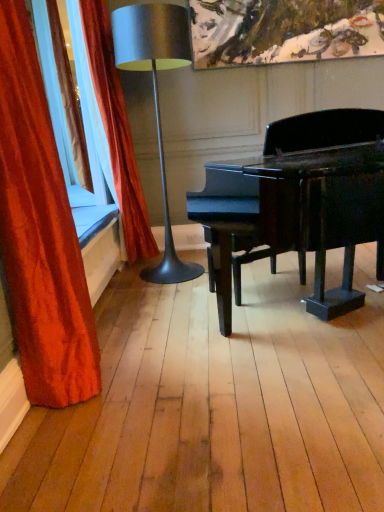
Image resolution: width=384 pixels, height=512 pixels. Find the location of `vacant space to the right of velvet red curtain at left, the second curtain viewed from the back`. vacant space to the right of velvet red curtain at left, the second curtain viewed from the back is located at coordinates (149, 375).